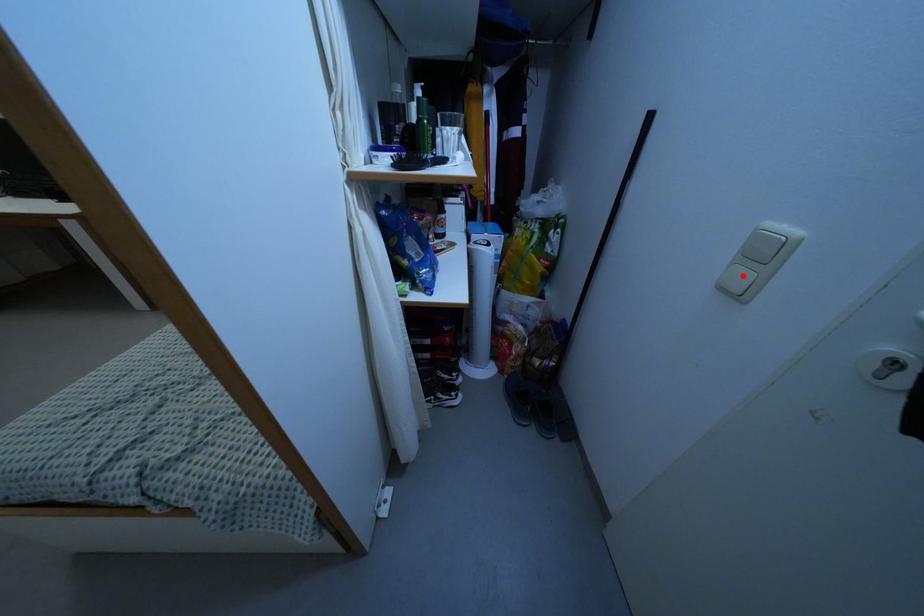
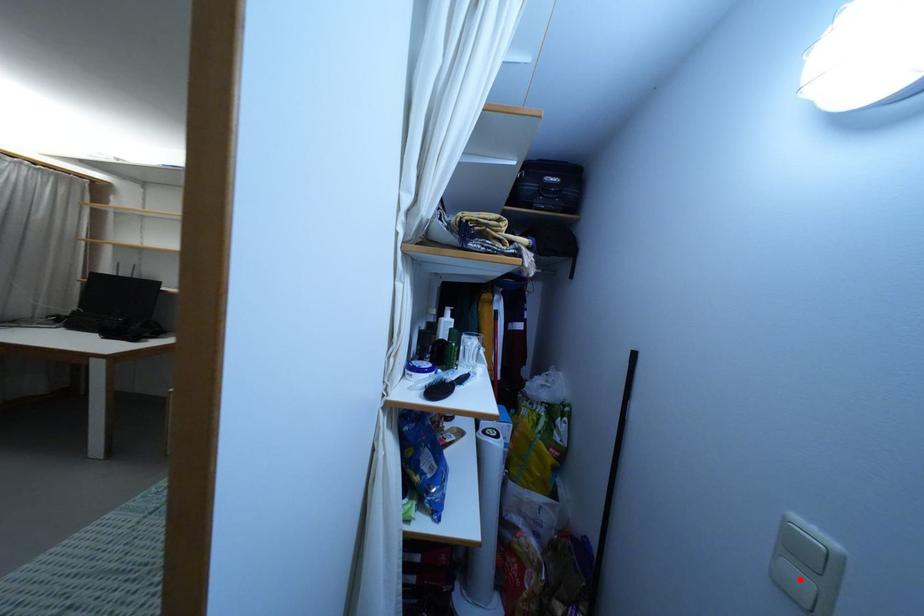
I am providing you with two images of the same scene from different viewpoints. A red point is marked on the first image and another point is marked on the second image. Is the marked point in image1 the same physical position as the marked point in image2?

Yes